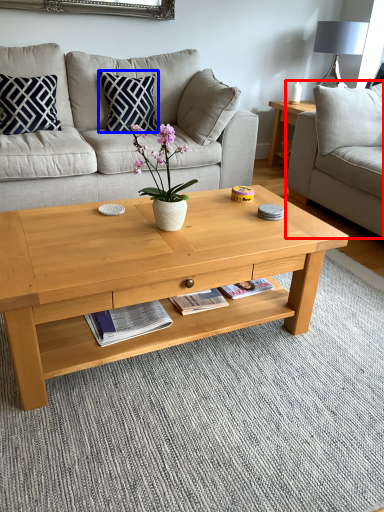
Question: Among these objects, which one is nearest to the camera, studio couch (highlighted by a red box) or pillow (highlighted by a blue box)?

Choices:
 (A) studio couch
 (B) pillow

Answer: (A)